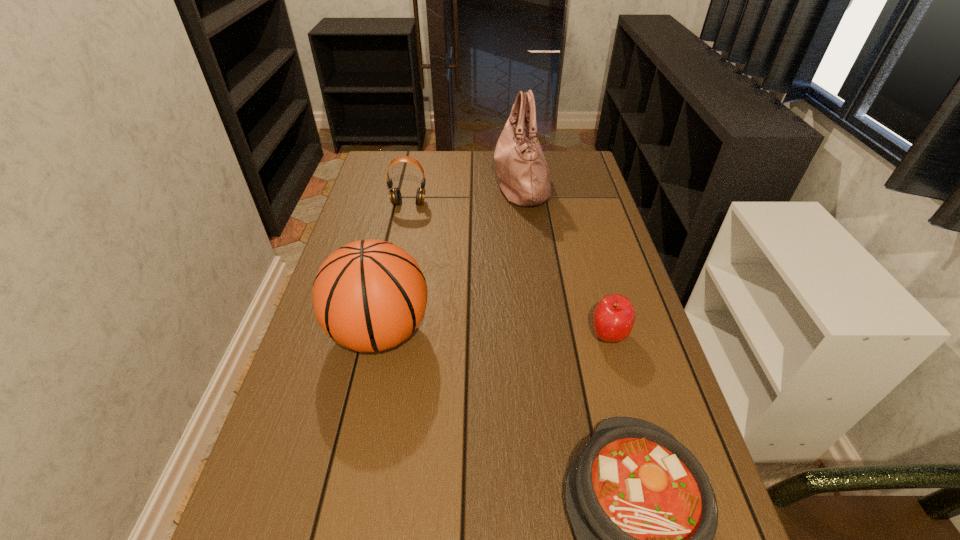
Where is `handbag`? The image size is (960, 540). handbag is located at coordinates (523, 175).

You are a GUI agent. You are given a task and a screenshot of the screen. Output one action in this format:
    pyautogui.click(x=<x>, y=<y>)
    Task: Click on the second tallest object
    
    Given the screenshot: What is the action you would take?
    pyautogui.click(x=370, y=295)

Find the location of a particular element. The width and height of the screenshot is (960, 540). the third tallest object is located at coordinates (395, 196).

In order to click on apple in this screenshot , I will do `click(613, 319)`.

The height and width of the screenshot is (540, 960). Identify the location of vacant region located at the front of the tallest object with handles. (470, 184).

The height and width of the screenshot is (540, 960). In order to click on vacant space situated at the front of the tallest object with handles in this screenshot , I will do coord(414,184).

At what (x,y) coordinates should I click in order to perform the action: click on free region located at the front of the tallest object with handles. Please return your answer as a coordinate pair (x, y). The height and width of the screenshot is (540, 960). Looking at the image, I should click on (420, 184).

This screenshot has width=960, height=540. In order to click on free spot located 0.210m on the right of the fourth shortest object in this screenshot , I will do `click(517, 332)`.

I want to click on blank area located on the ear cups of the third shortest object, so click(401, 239).

This screenshot has width=960, height=540. Identify the location of free region located on the left of the apple. (431, 335).